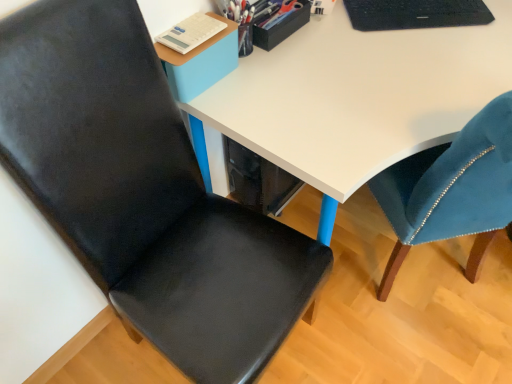
Question: Is black textured laptop at upper right aimed at white glossy desk at center?

Choices:
 (A) no
 (B) yes

Answer: (A)

Question: Can you confirm if black textured laptop at upper right is bigger than white glossy desk at center?

Choices:
 (A) no
 (B) yes

Answer: (A)

Question: Is black textured laptop at upper right taller than white glossy desk at center?

Choices:
 (A) no
 (B) yes

Answer: (A)

Question: Does black textured laptop at upper right have a lesser width compared to white glossy desk at center?

Choices:
 (A) no
 (B) yes

Answer: (B)

Question: Is black textured laptop at upper right behind white glossy desk at center?

Choices:
 (A) yes
 (B) no

Answer: (A)

Question: Can you confirm if black textured laptop at upper right is wider than white glossy desk at center?

Choices:
 (A) no
 (B) yes

Answer: (A)

Question: From the image's perspective, is white glossy desk at center above matte black chair at left?

Choices:
 (A) yes
 (B) no

Answer: (A)

Question: Is white glossy desk at center positioned far away from matte black chair at left?

Choices:
 (A) no
 (B) yes

Answer: (A)

Question: Is white glossy desk at center oriented towards matte black chair at left?

Choices:
 (A) yes
 (B) no

Answer: (B)

Question: Is white glossy desk at center not within matte black chair at left?

Choices:
 (A) yes
 (B) no

Answer: (A)

Question: Would you say white glossy desk at center contains matte black chair at left?

Choices:
 (A) yes
 (B) no

Answer: (B)

Question: Does white glossy desk at center have a larger size compared to matte black chair at left?

Choices:
 (A) yes
 (B) no

Answer: (A)

Question: Considering the relative sizes of black textured laptop at upper right and matte black chair at left in the image provided, is black textured laptop at upper right shorter than matte black chair at left?

Choices:
 (A) yes
 (B) no

Answer: (A)